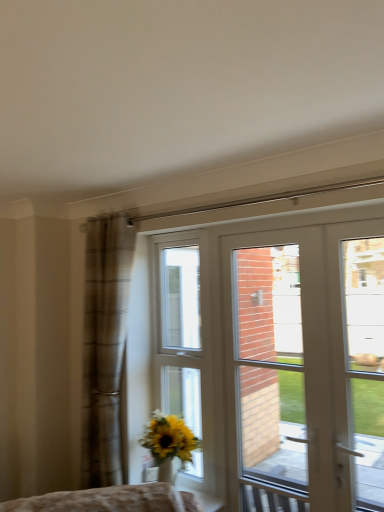
Question: Does white glossy door at center lie behind white glass door at right?

Choices:
 (A) yes
 (B) no

Answer: (A)

Question: From the image's perspective, is white glossy door at center located beneath white glass door at right?

Choices:
 (A) yes
 (B) no

Answer: (A)

Question: Could you tell me if white glossy door at center is facing white glass door at right?

Choices:
 (A) no
 (B) yes

Answer: (B)

Question: Considering the relative positions of white glossy door at center and white glass door at right in the image provided, is white glossy door at center to the left of white glass door at right from the viewer's perspective?

Choices:
 (A) no
 (B) yes

Answer: (B)

Question: Does white glossy door at center come in front of white glass door at right?

Choices:
 (A) yes
 (B) no

Answer: (B)

Question: Does point (372, 503) appear closer or farther from the camera than point (193, 432)?

Choices:
 (A) closer
 (B) farther

Answer: (A)

Question: Considering the positions of white glass door at right and white glossy window at center in the image, is white glass door at right wider or thinner than white glossy window at center?

Choices:
 (A) wide
 (B) thin

Answer: (A)

Question: In terms of size, does white glass door at right appear bigger or smaller than white glossy window at center?

Choices:
 (A) big
 (B) small

Answer: (A)

Question: From a real-world perspective, is white glass door at right physically located above or below white glossy window at center?

Choices:
 (A) below
 (B) above

Answer: (B)

Question: From their relative heights in the image, would you say white glass door at right is taller or shorter than brown plaid curtain at left?

Choices:
 (A) tall
 (B) short

Answer: (B)

Question: Is white glass door at right spatially inside brown plaid curtain at left, or outside of it?

Choices:
 (A) outside
 (B) inside

Answer: (A)

Question: Considering their positions, is white glass door at right located in front of or behind brown plaid curtain at left?

Choices:
 (A) behind
 (B) front

Answer: (B)

Question: From the image's perspective, relative to brown plaid curtain at left, is white glass door at right above or below?

Choices:
 (A) above
 (B) below

Answer: (A)

Question: From a real-world perspective, is white glossy door at center physically located above or below white glossy window at center?

Choices:
 (A) below
 (B) above

Answer: (A)

Question: From the image's perspective, relative to white glossy window at center, is white glossy door at center above or below?

Choices:
 (A) above
 (B) below

Answer: (A)